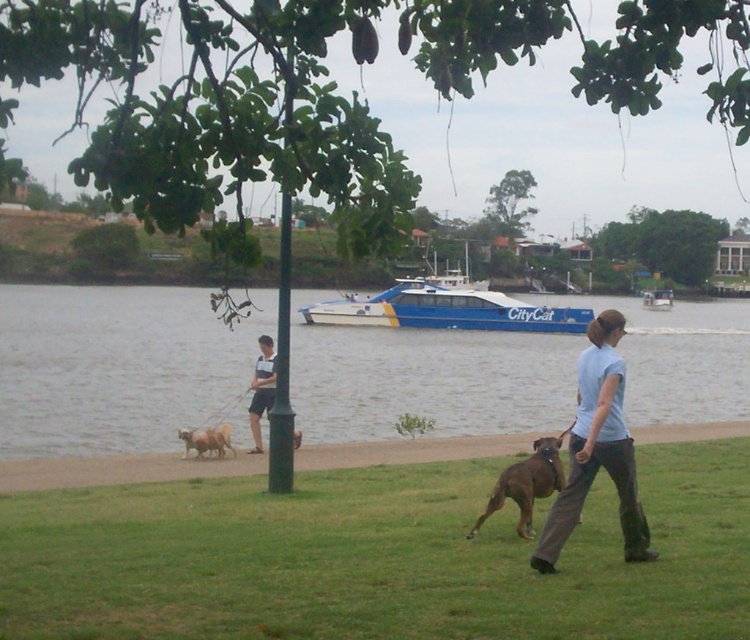
You are standing at the riverside and want to reach a specific point marked at coordinates point (x=582, y=358). If your maximum comfortable walking distance is 10 meters, can you comfortably reach that point without straining?

The distance of point (x=582, y=358) from camera is 11.83 meters, which exceeds your maximum comfortable walking distance of 10 meters. Therefore, you cannot comfortably reach that point without straining.

You are standing at the edge of the river and want to walk towards the light blue shirt at center. Which direction should you move relative to the green grass at lower center?

To reach the light blue shirt at center from the green grass at lower center, you should move to the right since the green grass at lower center is located to the left of the light blue shirt at center.

You are standing at the edge of the riverside scene. You notice the green grass at lower center and the light blue shirt at center. Which object is wider in this view?

The green grass at lower center is wider than the light blue shirt at center.